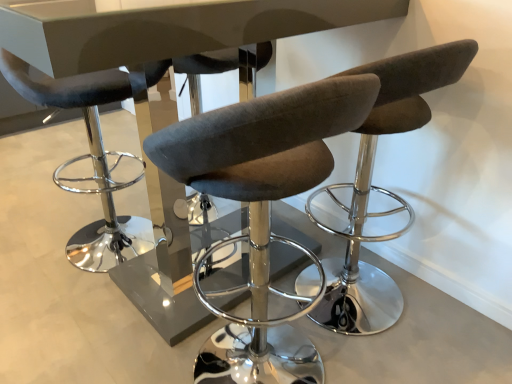
Question: Is glossy white table at center far away from matte black stool at left, marked as the first chair in a left-to-right arrangement?

Choices:
 (A) no
 (B) yes

Answer: (B)

Question: From the image's perspective, would you say glossy white table at center is shown under matte black stool at left, acting as the second chair starting from the right?

Choices:
 (A) yes
 (B) no

Answer: (A)

Question: Considering the relative sizes of glossy white table at center and matte black stool at left, marked as the first chair in a left-to-right arrangement, in the image provided, is glossy white table at center shorter than matte black stool at left, marked as the first chair in a left-to-right arrangement,?

Choices:
 (A) no
 (B) yes

Answer: (A)

Question: Is glossy white table at center to the left of matte black stool at left, marked as the first chair in a left-to-right arrangement, from the viewer's perspective?

Choices:
 (A) yes
 (B) no

Answer: (B)

Question: From a real-world perspective, is glossy white table at center under matte black stool at left, acting as the second chair starting from the right?

Choices:
 (A) yes
 (B) no

Answer: (B)

Question: From a real-world perspective, is glossy white table at center on matte black stool at left, marked as the first chair in a left-to-right arrangement?

Choices:
 (A) no
 (B) yes

Answer: (B)

Question: Would you say brown fabric stool at center, the first chair in the right-to-left sequence, contains matte black stool at left, marked as the first chair in a left-to-right arrangement?

Choices:
 (A) yes
 (B) no

Answer: (B)

Question: Is brown fabric stool at center, the first chair in the right-to-left sequence, oriented away from matte black stool at left, acting as the second chair starting from the right?

Choices:
 (A) yes
 (B) no

Answer: (B)

Question: Is brown fabric stool at center, which appears as the 2th chair when viewed from the left, taller than matte black stool at left, marked as the first chair in a left-to-right arrangement?

Choices:
 (A) no
 (B) yes

Answer: (B)

Question: Is brown fabric stool at center, which appears as the 2th chair when viewed from the left, to the left of matte black stool at left, acting as the second chair starting from the right, from the viewer's perspective?

Choices:
 (A) no
 (B) yes

Answer: (A)

Question: From a real-world perspective, is brown fabric stool at center, which appears as the 2th chair when viewed from the left, physically above matte black stool at left, marked as the first chair in a left-to-right arrangement?

Choices:
 (A) yes
 (B) no

Answer: (A)

Question: Considering the relative sizes of brown fabric stool at center, the first chair in the right-to-left sequence, and matte black stool at left, marked as the first chair in a left-to-right arrangement, in the image provided, is brown fabric stool at center, the first chair in the right-to-left sequence, bigger than matte black stool at left, marked as the first chair in a left-to-right arrangement,?

Choices:
 (A) yes
 (B) no

Answer: (A)

Question: Considering the relative positions of matte black stool at left, acting as the second chair starting from the right, and brown fabric stool at center, the first chair in the right-to-left sequence, in the image provided, is matte black stool at left, acting as the second chair starting from the right, to the left of brown fabric stool at center, the first chair in the right-to-left sequence, from the viewer's perspective?

Choices:
 (A) no
 (B) yes

Answer: (B)